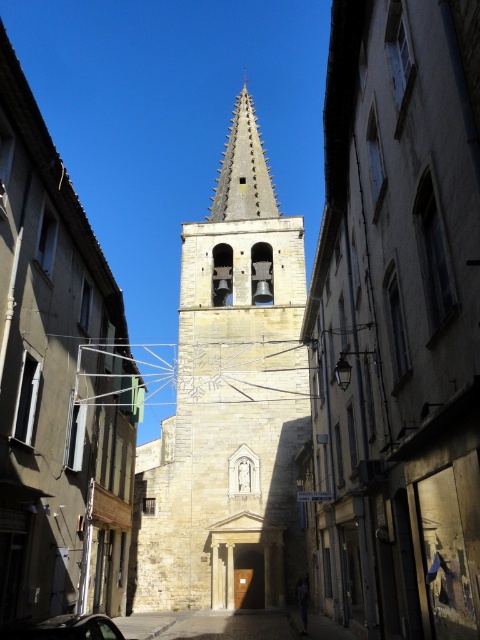
You are standing at the entrance of the narrow street and want to locate the stone bell tower at center. According to the coordinates provided, where should you look relative to your position?

The stone bell tower at center is located at coordinates point (229, 403), which means it is positioned to the right and slightly above your current viewpoint.

You are standing in the narrow street looking towards the church tower. There are two points marked on the image, one at coordinates point (254, 148) and another at point (34, 632). Which point is closer to you as you face the church tower?

Point (254, 148) is closer to you because it is further to the viewer than point (34, 632).

You are driving a car that is 5 meters long and want to park it in a space between the stone bell tower at center and the metallic car at center. The parking space is exactly 6 meters long. Can you fit your car in this space?

The distance between the stone bell tower at center and the metallic car at center is 59.69 meters, which is much longer than the 6 meter parking space. Therefore, the car can easily fit within the 6 meter space available.